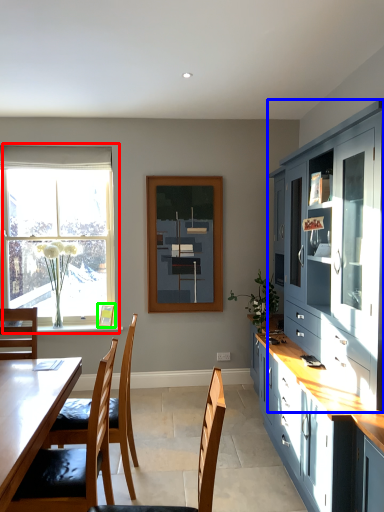
Question: Considering the real-world distances, which object is closest to window (highlighted by a red box)? cabinetry (highlighted by a blue box) or picture frame (highlighted by a green box).

Choices:
 (A) cabinetry
 (B) picture frame

Answer: (B)